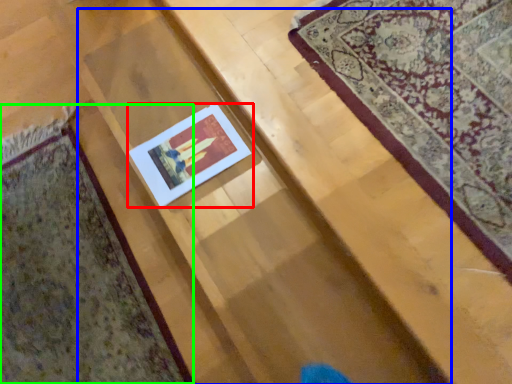
Question: Considering the real-world distances, which object is farthest from picture frame (highlighted by a red box)? stairwell (highlighted by a blue box) or mat (highlighted by a green box)?

Choices:
 (A) stairwell
 (B) mat

Answer: (B)